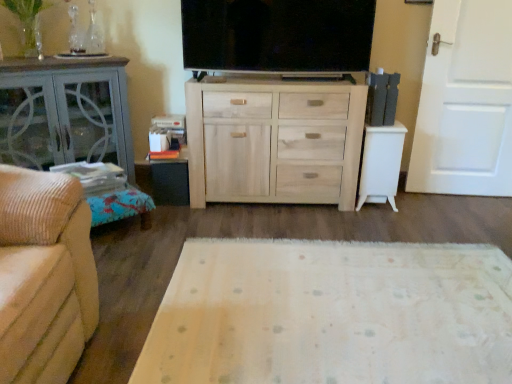
Question: Does white glossy side table at right, the 3th table in the left-to-right sequence, have a larger size compared to black matte table at lower left, the second table positioned from the left?

Choices:
 (A) no
 (B) yes

Answer: (B)

Question: Is white glossy side table at right, the 3th table in the left-to-right sequence, not inside black matte table at lower left, the second table positioned from the left?

Choices:
 (A) yes
 (B) no

Answer: (A)

Question: Does white glossy side table at right, the 3th table in the left-to-right sequence, have a smaller size compared to black matte table at lower left, the second table positioned from the left?

Choices:
 (A) yes
 (B) no

Answer: (B)

Question: Are white glossy side table at right, the 3th table in the left-to-right sequence, and black matte table at lower left, the second table positioned from the left, making contact?

Choices:
 (A) yes
 (B) no

Answer: (B)

Question: Is white glossy side table at right, the 1th table from the right, behind black matte table at lower left, the second table positioned from the left?

Choices:
 (A) no
 (B) yes

Answer: (A)

Question: Is point (133, 157) closer or farther from the camera than point (294, 153)?

Choices:
 (A) closer
 (B) farther

Answer: (B)

Question: Based on their positions, is matte gray cabinet at left, placed as the third table when sorted from right to left, located to the left or right of light wood/unfinished chest of drawers at center?

Choices:
 (A) left
 (B) right

Answer: (A)

Question: Is matte gray cabinet at left, placed as the third table when sorted from right to left, bigger or smaller than light wood/unfinished chest of drawers at center?

Choices:
 (A) small
 (B) big

Answer: (A)

Question: From the image's perspective, is matte gray cabinet at left, the first table viewed from the left, positioned above or below light wood/unfinished chest of drawers at center?

Choices:
 (A) above
 (B) below

Answer: (A)

Question: Considering the relative positions of light wood/unfinished chest of drawers at center and black matte table at lower left, placed as the second table when sorted from right to left, in the image provided, is light wood/unfinished chest of drawers at center to the left or to the right of black matte table at lower left, placed as the second table when sorted from right to left,?

Choices:
 (A) right
 (B) left

Answer: (A)

Question: Relative to black matte table at lower left, the second table positioned from the left, is light wood/unfinished chest of drawers at center in front or behind?

Choices:
 (A) behind
 (B) front

Answer: (B)

Question: From a real-world perspective, is light wood/unfinished chest of drawers at center physically located above or below black matte table at lower left, the second table positioned from the left?

Choices:
 (A) above
 (B) below

Answer: (A)

Question: From the image's perspective, is light wood/unfinished chest of drawers at center positioned above or below black matte table at lower left, placed as the second table when sorted from right to left?

Choices:
 (A) above
 (B) below

Answer: (A)

Question: Considering the positions of white wooden door at right and white glossy side table at right, the 3th table in the left-to-right sequence, in the image, is white wooden door at right taller or shorter than white glossy side table at right, the 3th table in the left-to-right sequence,?

Choices:
 (A) tall
 (B) short

Answer: (A)

Question: Considering their positions, is white wooden door at right located in front of or behind white glossy side table at right, the 1th table from the right?

Choices:
 (A) front
 (B) behind

Answer: (A)